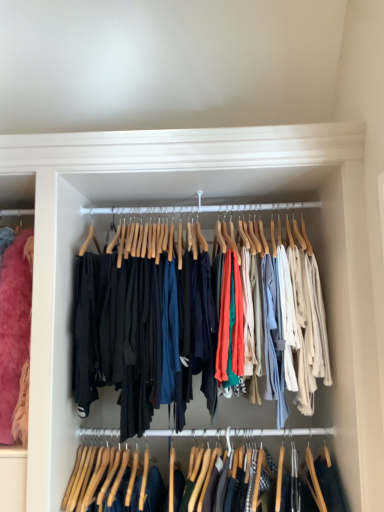
Question: Which direction should I rotate to look at denim jeans at center, acting as the 1th closet starting from the bottom, — up or down?

Choices:
 (A) up
 (B) down

Answer: (B)

Question: Is the position of matte black pants at center, which appears as the first closet when viewed from the top, less distant than that of denim jeans at center, acting as the 1th closet starting from the bottom?

Choices:
 (A) no
 (B) yes

Answer: (A)

Question: From the image's perspective, does matte black pants at center, which appears as the first closet when viewed from the top, appear lower than denim jeans at center, the 2th closet from the top?

Choices:
 (A) yes
 (B) no

Answer: (B)

Question: Is matte black pants at center, which appears as the first closet when viewed from the top, taller than denim jeans at center, the 2th closet from the top?

Choices:
 (A) no
 (B) yes

Answer: (B)

Question: Considering the relative sizes of matte black pants at center, the 2th closet from the bottom, and denim jeans at center, the 2th closet from the top, in the image provided, is matte black pants at center, the 2th closet from the bottom, thinner than denim jeans at center, the 2th closet from the top,?

Choices:
 (A) no
 (B) yes

Answer: (A)

Question: Is denim jeans at center, the 2th closet from the top, completely or partially inside matte black pants at center, which appears as the first closet when viewed from the top?

Choices:
 (A) no
 (B) yes

Answer: (A)

Question: Does matte black pants at center, the 2th closet from the bottom, have a greater width compared to denim jeans at center, acting as the 1th closet starting from the bottom?

Choices:
 (A) no
 (B) yes

Answer: (B)

Question: Is denim jeans at center, acting as the 1th closet starting from the bottom, oriented away from matte black pants at center, which appears as the first closet when viewed from the top?

Choices:
 (A) no
 (B) yes

Answer: (A)

Question: Considering the relative positions of denim jeans at center, acting as the 1th closet starting from the bottom, and matte black pants at center, the 2th closet from the bottom, in the image provided, is denim jeans at center, acting as the 1th closet starting from the bottom, in front of matte black pants at center, the 2th closet from the bottom,?

Choices:
 (A) no
 (B) yes

Answer: (B)

Question: Does denim jeans at center, the 2th closet from the top, have a greater width compared to matte black pants at center, the 2th closet from the bottom?

Choices:
 (A) no
 (B) yes

Answer: (A)

Question: Considering the relative positions of denim jeans at center, the 2th closet from the top, and matte black pants at center, the 2th closet from the bottom, in the image provided, is denim jeans at center, the 2th closet from the top, to the left of matte black pants at center, the 2th closet from the bottom, from the viewer's perspective?

Choices:
 (A) yes
 (B) no

Answer: (B)

Question: Considering the relative sizes of denim jeans at center, the 2th closet from the top, and matte black pants at center, which appears as the first closet when viewed from the top, in the image provided, is denim jeans at center, the 2th closet from the top, bigger than matte black pants at center, which appears as the first closet when viewed from the top,?

Choices:
 (A) yes
 (B) no

Answer: (B)

Question: Does denim jeans at center, the 2th closet from the top, have a smaller size compared to matte black pants at center, the 2th closet from the bottom?

Choices:
 (A) no
 (B) yes

Answer: (B)

Question: Based on their sizes in the image, would you say matte black pants at center, which appears as the first closet when viewed from the top, is bigger or smaller than denim jeans at center, the 2th closet from the top?

Choices:
 (A) small
 (B) big

Answer: (B)